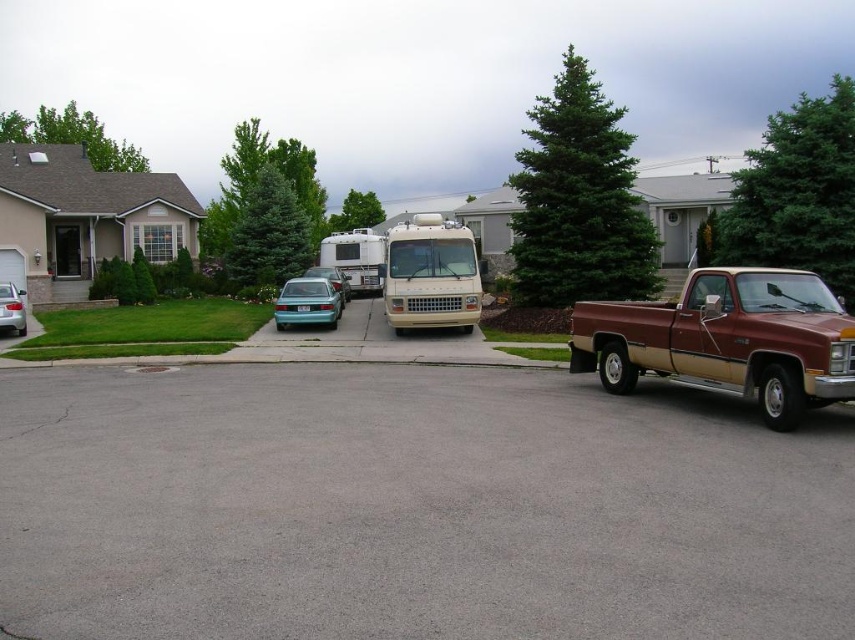
Does point (386, 616) come behind point (289, 320)?

No.

Is gray asphalt driveway at lower right shorter than teal glossy hatchback at center?

Yes, gray asphalt driveway at lower right is shorter than teal glossy hatchback at center.

Does point (410, 380) come closer to viewer compared to point (334, 321)?

That is True.

Identify the location of gray asphalt driveway at lower right. The image size is (855, 640). (413, 508).

Is brown metallic truck at right positioned at the back of teal matte car at center?

That is False.

Between point (581, 336) and point (346, 288), which one is positioned in front?

Point (581, 336) is more forward.

Find the location of a particular element. The height and width of the screenshot is (640, 855). brown metallic truck at right is located at coordinates (727, 339).

Can you confirm if beige matte rv at center is thinner than teal glossy hatchback at center?

Incorrect, beige matte rv at center's width is not less than teal glossy hatchback at center's.

Between point (398, 227) and point (295, 316), which one is positioned behind?

The point (295, 316) is more distant.

You are a GUI agent. You are given a task and a screenshot of the screen. Output one action in this format:
    pyautogui.click(x=<x>, y=<y>)
    Task: Click on the beige matte rv at center
    The height and width of the screenshot is (640, 855).
    Given the screenshot: What is the action you would take?
    [429, 275]